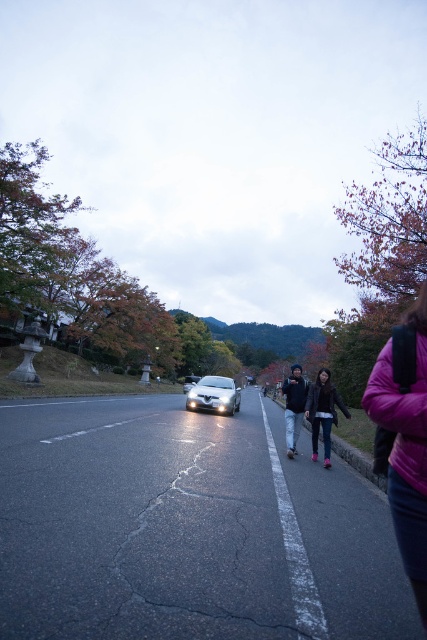
Question: In this image, where is purple fleece jacket at lower right located relative to dark brown leather jacket at center?

Choices:
 (A) below
 (B) above

Answer: (B)

Question: Estimate the real-world distances between objects in this image. Which object is farther from the glossy white car at center?

Choices:
 (A) dark brown leather jacket at center
 (B) purple fleece jacket at lower right
 (C) silver metallic car at center

Answer: (B)

Question: Estimate the real-world distances between objects in this image. Which object is farther from the dark blue jeans at center?

Choices:
 (A) glossy white car at center
 (B) dark brown leather jacket at center
 (C) silver metallic car at center

Answer: (A)

Question: Does purple fleece jacket at lower right appear under silver metallic car at center?

Choices:
 (A) no
 (B) yes

Answer: (A)

Question: Is purple fleece jacket at lower right in front of silver metallic car at center?

Choices:
 (A) yes
 (B) no

Answer: (A)

Question: Which object is farther from the camera taking this photo?

Choices:
 (A) purple fleece jacket at lower right
 (B) dark blue jeans at center
 (C) glossy white car at center
 (D) silver metallic car at center

Answer: (C)